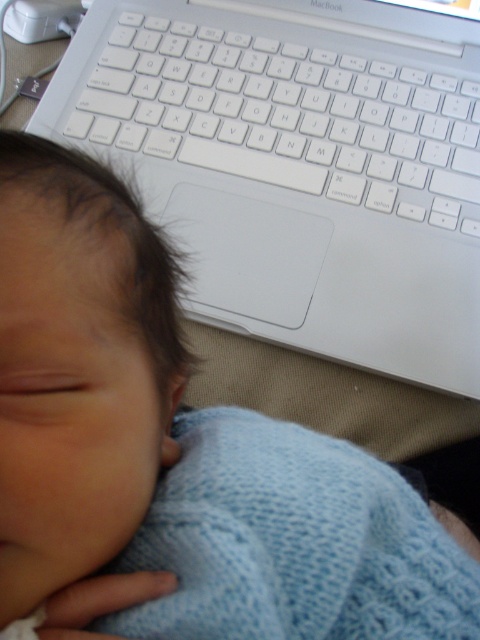
You are a photographer taking a picture of the sleeping baby. You notice two points in the scene at coordinates point (299, 198) and point (273, 548). Which point is closer to your camera lens?

Point (299, 198) is further to the viewer than point (273, 548), so the point closer to the camera lens is point (273, 548).

You are a photographer taking a picture of the sleeping baby. You notice a point at coordinates (287, 106). Where is this point located in the scene?

The point at coordinates (287, 106) is located on the white plastic keyboard at upper center.